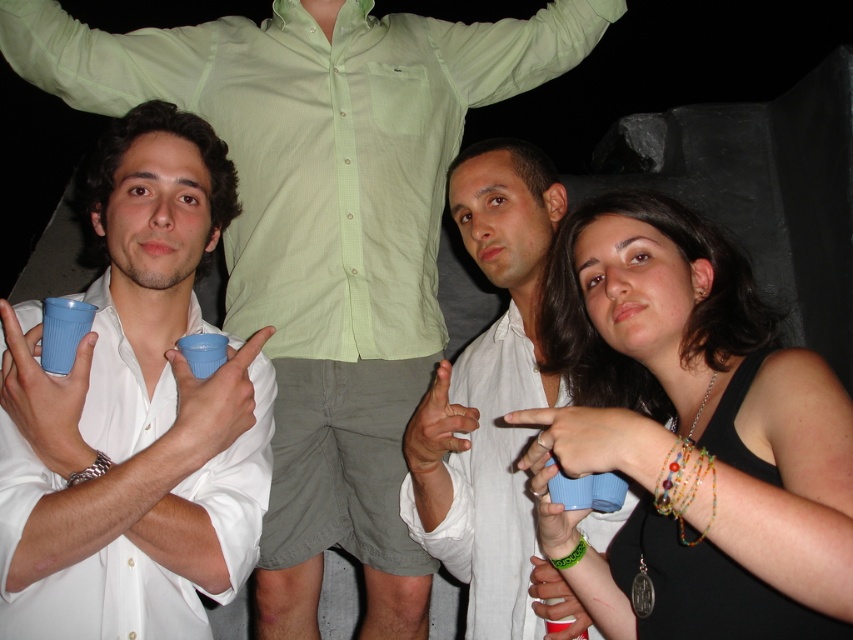
Question: Which point is farther to the camera?

Choices:
 (A) white matte shirt at center
 (B) matte plastic cup at left

Answer: (A)

Question: Does matte blue cup at center appear on the left side of matte plastic cup at left?

Choices:
 (A) yes
 (B) no

Answer: (B)

Question: Does matte plastic cup at left come behind white matte shirt at center?

Choices:
 (A) yes
 (B) no

Answer: (B)

Question: Which point is closer to the camera taking this photo?

Choices:
 (A) (466, 385)
 (B) (128, 426)
 (C) (399, 244)

Answer: (B)

Question: Which object is positioned closest to the matte white shirt at center?

Choices:
 (A) matte blue cup at center
 (B) matte plastic cup at left

Answer: (B)

Question: Is matte blue cup at center below white matte shirt at center?

Choices:
 (A) no
 (B) yes

Answer: (B)